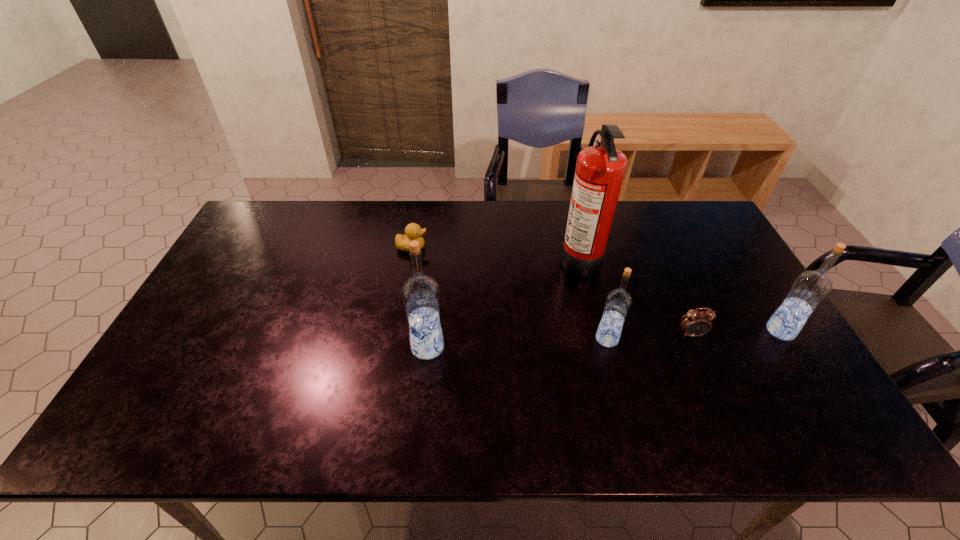
I want to click on free space between the second shortest vodka and the duckling, so click(596, 289).

Where is `free space between the second object from right to left and the rightmost vodka`? free space between the second object from right to left and the rightmost vodka is located at coordinates (735, 333).

Identify the location of object that stands as the fourth closest to the duckling. (695, 323).

Locate an element on the screen. This screenshot has height=540, width=960. object that is the second closest to the second vodka from right to left is located at coordinates (600, 169).

Select which vodka appears as the second closest to the alarm clock. Please provide its 2D coordinates. Your answer should be formatted as a tuple, i.e. [(x, y)], where the tuple contains the x and y coordinates of a point satisfying the conditions above.

[(810, 288)]

Locate which vodka is the second closest to the third shortest object. Please provide its 2D coordinates. Your answer should be formatted as a tuple, i.e. [(x, y)], where the tuple contains the x and y coordinates of a point satisfying the conditions above.

[(810, 288)]

Find the location of `vacant space that satisfies the following two spatial constraints: 1. facing forward on the duckling; 2. on the back side of the leftmost vodka`. vacant space that satisfies the following two spatial constraints: 1. facing forward on the duckling; 2. on the back side of the leftmost vodka is located at coordinates pyautogui.click(x=395, y=347).

This screenshot has width=960, height=540. What are the coordinates of `free point that satisfies the following two spatial constraints: 1. on the front-facing side of the tallest object; 2. on the right side of the shortest vodka` in the screenshot? It's located at (600, 339).

Locate an element on the screen. Image resolution: width=960 pixels, height=540 pixels. vacant space that satisfies the following two spatial constraints: 1. on the front-facing side of the tallest object; 2. on the back side of the shortest vodka is located at coordinates (x=600, y=339).

Locate an element on the screen. The height and width of the screenshot is (540, 960). blank area in the image that satisfies the following two spatial constraints: 1. facing forward on the duckling; 2. on the right side of the leftmost vodka is located at coordinates (395, 347).